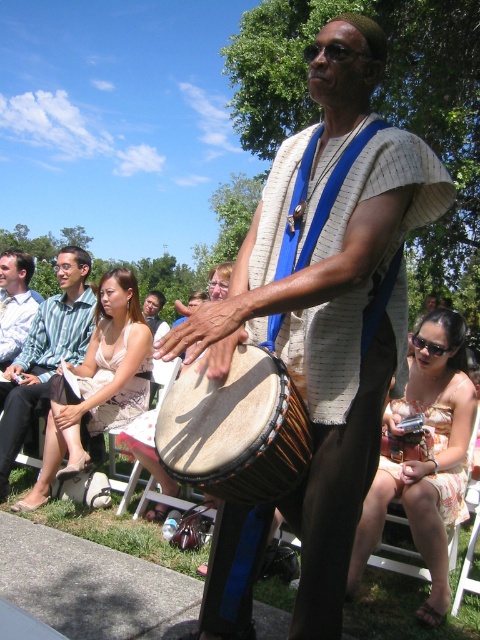
Question: Can you confirm if natural wood drum at center is positioned to the right of matte white dress at center?

Choices:
 (A) no
 (B) yes

Answer: (B)

Question: Does natural wood drum at center have a greater width compared to matte white dress at center?

Choices:
 (A) no
 (B) yes

Answer: (A)

Question: Which is nearer to the green fabric dress at left?

Choices:
 (A) natural wood drum at center
 (B) matte brown drum at center
 (C) matte white dress at center

Answer: (A)

Question: Does natural wood drum at center appear on the right side of green fabric dress at left?

Choices:
 (A) yes
 (B) no

Answer: (A)

Question: Which point is farther to the camera?

Choices:
 (A) (236, 355)
 (B) (154, 312)

Answer: (B)

Question: Which point is closer to the camera?

Choices:
 (A) natural wood drum at center
 (B) matte brown drum at center
 (C) green fabric dress at left

Answer: (B)